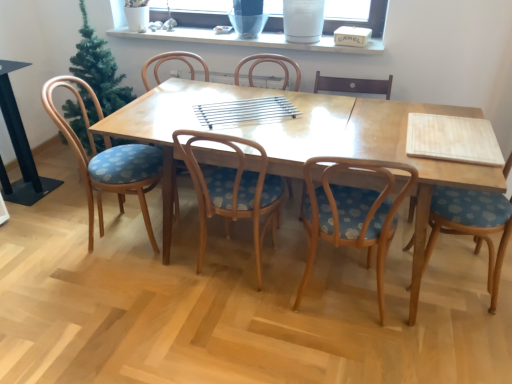
Question: Is transparent glass window screen at upper center not close to wooden chair with blue floral cushion at center, acting as the 5th chair starting from the left?

Choices:
 (A) no
 (B) yes

Answer: (B)

Question: Is transparent glass window screen at upper center shorter than wooden chair with blue floral cushion at center, acting as the 5th chair starting from the left?

Choices:
 (A) no
 (B) yes

Answer: (B)

Question: From the image's perspective, would you say transparent glass window screen at upper center is positioned over wooden chair with blue floral cushion at center, positioned as the second chair in right-to-left order?

Choices:
 (A) no
 (B) yes

Answer: (B)

Question: Is transparent glass window screen at upper center oriented towards wooden chair with blue floral cushion at center, acting as the 5th chair starting from the left?

Choices:
 (A) yes
 (B) no

Answer: (B)

Question: Is transparent glass window screen at upper center located outside wooden chair with blue floral cushion at center, acting as the 5th chair starting from the left?

Choices:
 (A) no
 (B) yes

Answer: (B)

Question: From the image's perspective, does transparent glass window screen at upper center appear lower than wooden chair with blue floral cushion at center, acting as the 5th chair starting from the left?

Choices:
 (A) yes
 (B) no

Answer: (B)

Question: Can you confirm if transparent glass window screen at upper center is bigger than light brown wooden table at center?

Choices:
 (A) yes
 (B) no

Answer: (B)

Question: Does transparent glass window screen at upper center turn towards light brown wooden table at center?

Choices:
 (A) no
 (B) yes

Answer: (A)

Question: Does transparent glass window screen at upper center have a greater width compared to light brown wooden table at center?

Choices:
 (A) yes
 (B) no

Answer: (B)

Question: Does transparent glass window screen at upper center have a lesser height compared to light brown wooden table at center?

Choices:
 (A) yes
 (B) no

Answer: (A)

Question: Is transparent glass window screen at upper center located outside light brown wooden table at center?

Choices:
 (A) yes
 (B) no

Answer: (A)

Question: Considering the relative sizes of transparent glass window screen at upper center and light brown wooden table at center in the image provided, is transparent glass window screen at upper center smaller than light brown wooden table at center?

Choices:
 (A) no
 (B) yes

Answer: (B)

Question: Does wooden chair with blue floral cushion at left, acting as the first chair starting from the left, appear on the right side of wooden chair with blue patterned seat at center, which is the second chair in left-to-right order?

Choices:
 (A) yes
 (B) no

Answer: (B)